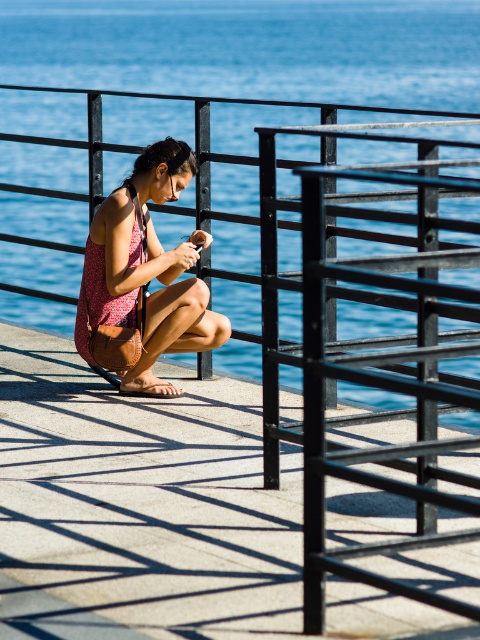
Question: Which object appears farthest from the camera in this image?

Choices:
 (A) matte leather dock at center
 (B) matte brown purse at center
 (C) blue water at center

Answer: (B)

Question: Is matte leather dock at center smaller than blue water at center?

Choices:
 (A) yes
 (B) no

Answer: (A)

Question: In this image, where is blue water at center located relative to matte brown purse at center?

Choices:
 (A) below
 (B) above

Answer: (B)

Question: Is matte leather dock at center further to the viewer compared to blue water at center?

Choices:
 (A) yes
 (B) no

Answer: (B)

Question: Which point is farther from the camera taking this photo?

Choices:
 (A) (11, 326)
 (B) (3, 141)

Answer: (B)

Question: Considering the real-world distances, which object is farthest from the matte brown purse at center?

Choices:
 (A) blue water at center
 (B) matte leather dock at center

Answer: (A)